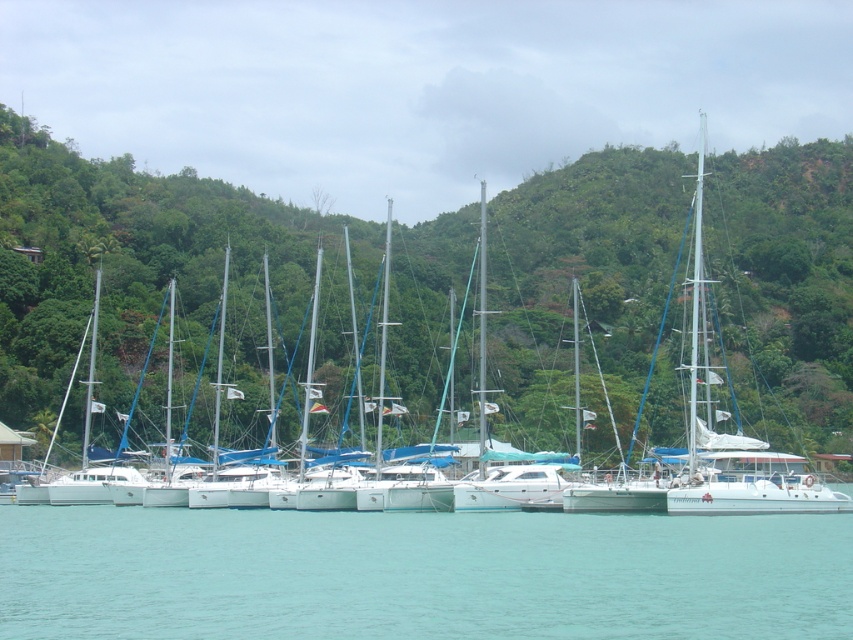
Question: Considering the relative positions of green leafy tree at center and clear blue water at lower center in the image provided, where is green leafy tree at center located with respect to clear blue water at lower center?

Choices:
 (A) above
 (B) below

Answer: (A)

Question: Which point is closer to the camera taking this photo?

Choices:
 (A) (415, 440)
 (B) (396, 614)

Answer: (B)

Question: Does green leafy tree at center have a smaller size compared to clear blue water at lower center?

Choices:
 (A) no
 (B) yes

Answer: (A)

Question: Which point is closer to the camera?

Choices:
 (A) (13, 305)
 (B) (689, 516)

Answer: (B)

Question: Can you confirm if green leafy tree at center is smaller than clear blue water at lower center?

Choices:
 (A) no
 (B) yes

Answer: (A)